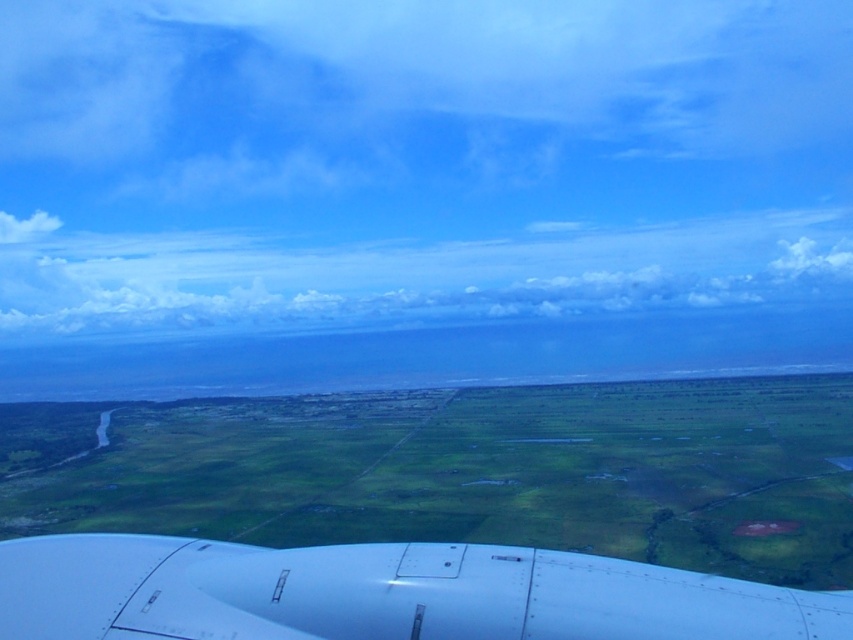
Question: Based on their relative distances, which object is farther from the white matte airplane wing at bottom?

Choices:
 (A) green grassland at center
 (B) cloudy sky at upper center

Answer: (B)

Question: Is green grassland at center above white matte airplane wing at bottom?

Choices:
 (A) yes
 (B) no

Answer: (B)

Question: Based on their relative distances, which object is nearer to the white matte airplane wing at bottom?

Choices:
 (A) green grassland at center
 (B) cloudy sky at upper center

Answer: (A)

Question: Which point appears closest to the camera in this image?

Choices:
 (A) (265, 410)
 (B) (289, 566)
 (C) (410, 310)

Answer: (B)

Question: From the image, what is the correct spatial relationship of green grassland at center in relation to white matte airplane wing at bottom?

Choices:
 (A) below
 (B) above

Answer: (A)

Question: Can you confirm if green grassland at center is positioned below cloudy sky at upper center?

Choices:
 (A) no
 (B) yes

Answer: (B)